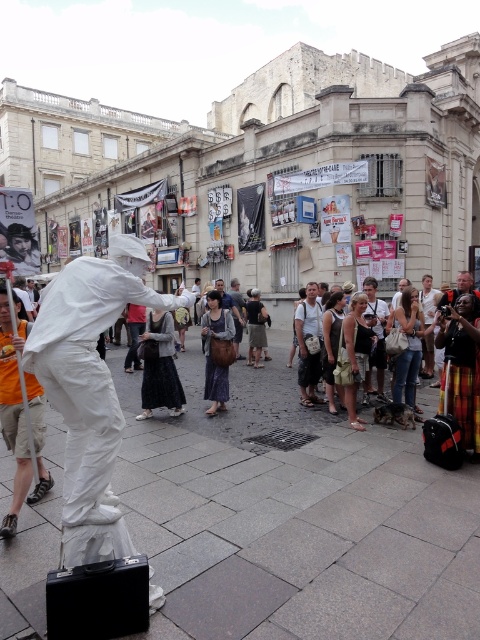
You are a photographer standing at the entrance of the street scene. You want to capture the performer in white balancing on a black suitcase. Which object at point (159, 365) corresponds to the dark grey fabric dress worn by the performer?

The dark grey fabric dress at center corresponds to the point (159, 365).

You are standing in the middle of the street and see two points in the image, point (377, 397) and point (230, 330). Which point is closer to you?

Point (377, 397) is further to the viewer than point (230, 330), so point (230, 330) is closer to you.

You are a photographer trying to capture the performer in the center of the image. The performer is wearing a white cotton shirt and is standing at the point with coordinates (375, 336). You want to ensure the performer is centered in your shot. Is the point where the performer is standing already at the center of the image?

The point (375, 336) is on white cotton shirt at center, so yes, the performer is already centered in the image.